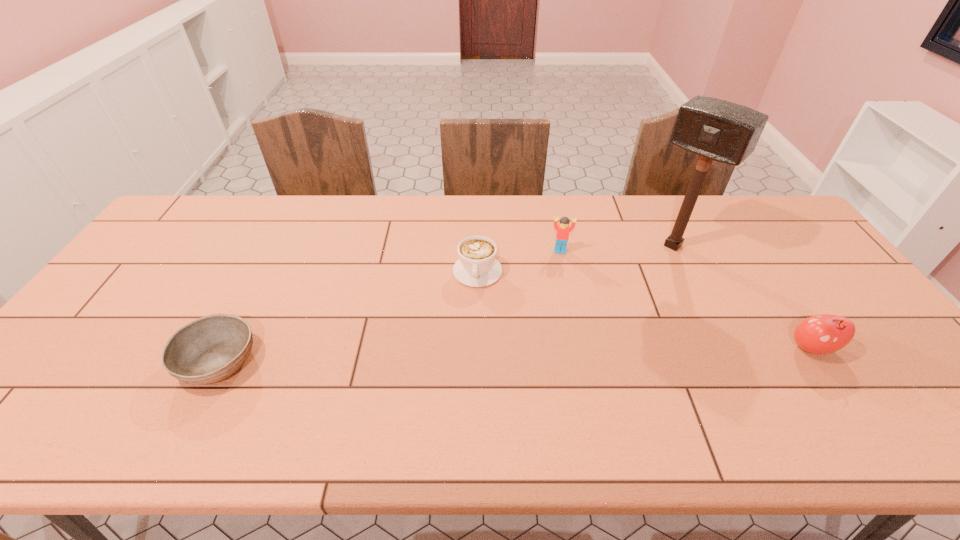
Identify the location of vacant space on the desktop that is between the bowl and the rightmost object and is positioned on the face of the Lego. The image size is (960, 540). (564, 354).

Where is `vacant space on the desktop that is between the leftmost object and the apple and is positioned on the head of the mallet`? This screenshot has width=960, height=540. vacant space on the desktop that is between the leftmost object and the apple and is positioned on the head of the mallet is located at coordinates (563, 354).

Locate an element on the screen. vacant space on the desktop that is between the leftmost object and the rightmost object and is positioned to the right of the cappuccino's handle is located at coordinates (472, 356).